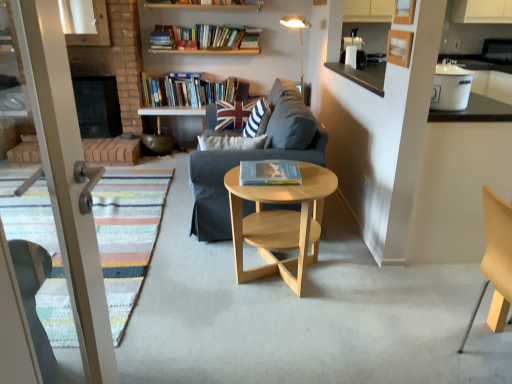
Question: Is white glossy container at upper right with natural wood coffee table at center?

Choices:
 (A) no
 (B) yes

Answer: (A)

Question: Does white glossy container at upper right have a larger size compared to natural wood coffee table at center?

Choices:
 (A) yes
 (B) no

Answer: (B)

Question: Does white glossy container at upper right appear on the right side of natural wood coffee table at center?

Choices:
 (A) no
 (B) yes

Answer: (B)

Question: Considering the relative sizes of white glossy container at upper right and natural wood coffee table at center in the image provided, is white glossy container at upper right smaller than natural wood coffee table at center?

Choices:
 (A) yes
 (B) no

Answer: (A)

Question: From the image's perspective, is white glossy container at upper right located above natural wood coffee table at center?

Choices:
 (A) yes
 (B) no

Answer: (A)

Question: Is white glossy container at upper right surrounding natural wood coffee table at center?

Choices:
 (A) no
 (B) yes

Answer: (A)

Question: Considering the relative sizes of union jack fabric pillow at center, the 2th pillow in the front-to-back sequence, and hardcover book at center, which appears as the 2th book when viewed from the top, in the image provided, is union jack fabric pillow at center, the 2th pillow in the front-to-back sequence, wider than hardcover book at center, which appears as the 2th book when viewed from the top,?

Choices:
 (A) no
 (B) yes

Answer: (A)

Question: Can you confirm if union jack fabric pillow at center, the 1th pillow in the back-to-front sequence, is taller than hardcover book at center, which ranks as the second book in left-to-right order?

Choices:
 (A) no
 (B) yes

Answer: (B)

Question: Is union jack fabric pillow at center, the 1th pillow in the back-to-front sequence, bigger than hardcover book at center, which is counted as the first book, starting from the right?

Choices:
 (A) no
 (B) yes

Answer: (B)

Question: Does union jack fabric pillow at center, the 2th pillow in the front-to-back sequence, contain hardcover book at center, the first book positioned from the front?

Choices:
 (A) no
 (B) yes

Answer: (A)

Question: Is union jack fabric pillow at center, the 2th pillow in the front-to-back sequence, completely or partially outside of hardcover book at center, the first book positioned from the front?

Choices:
 (A) no
 (B) yes

Answer: (B)

Question: Can you confirm if union jack fabric pillow at center, the 2th pillow in the front-to-back sequence, is positioned to the left of hardcover book at center, which ranks as the second book in left-to-right order?

Choices:
 (A) yes
 (B) no

Answer: (A)

Question: Is hardcover book at center, which ranks as the second book in left-to-right order, not within natural wood coffee table at center?

Choices:
 (A) yes
 (B) no

Answer: (B)